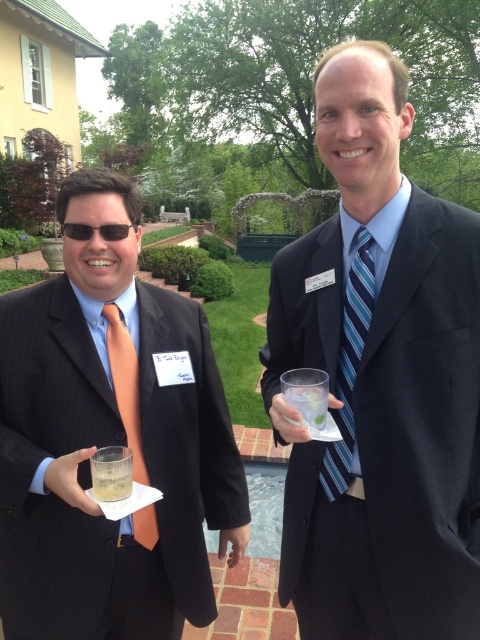
You are a photographer positioned in front of the two men in the scene. You need to take a clear photo of both the matte black suit at center and the blue striped tie at right. Which object will appear larger in your photo?

The matte black suit at center will appear larger in the photo because it is closer to the viewer than the blue striped tie at right.

You are at a formal event and need to locate the matte orange tie at left and the clear plastic cup at center. From the perspective of someone facing the scene, which object is positioned to the right?

The clear plastic cup at center is to the right of the matte orange tie at left.

You are standing at the origin point in the garden scene. There are two points marked in the image, point 1 at coordinates point [128,387] and point 2 at coordinates point [303,413]. If you were to walk from point 1 to point 2, would you be moving forward or backward in the scene?

Point [128,387] is behind point [303,413] in the scene. Therefore, moving from point 1 to point 2 would mean moving forward towards the front of the scene.